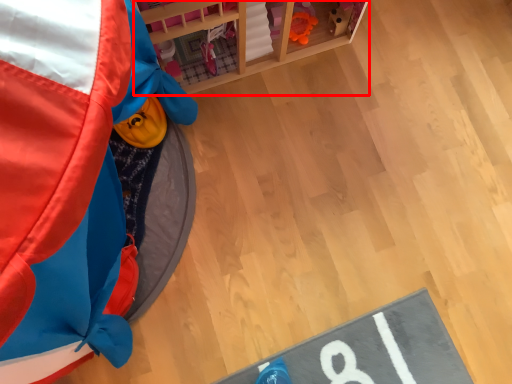
Question: From the image's perspective, where is furniture (annotated by the red box) located relative to toy?

Choices:
 (A) above
 (B) below

Answer: (A)